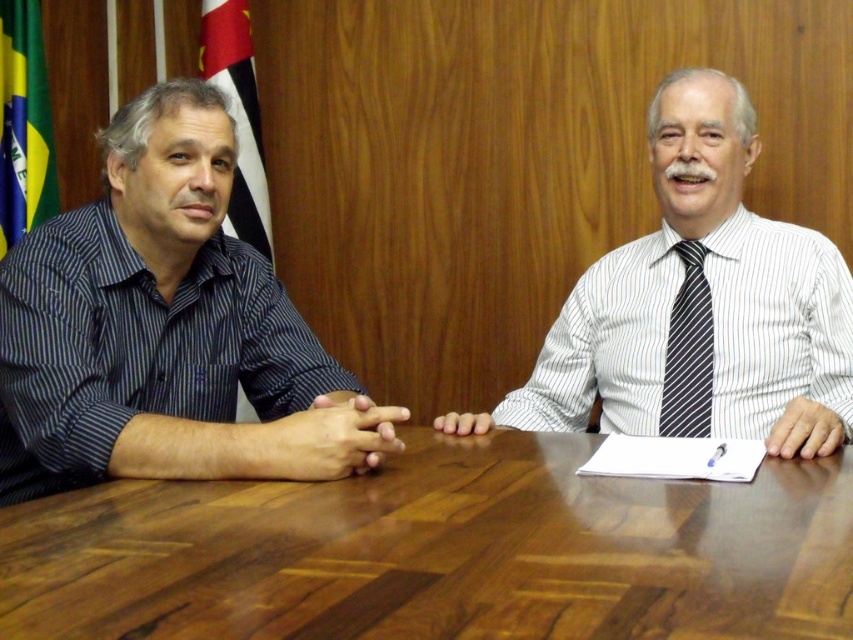
Based on the photo, you are standing 5 feet away from the table where the two individuals are seated. You want to reach the point at coordinates point (13, 129) on the table. Can you reach it without moving closer than your current position?

The distance of point (13, 129) from viewer is 6.69 feet, so you are currently 5 feet away and need to reach a point that is 6.69 feet away. This means you cannot reach it without moving closer.